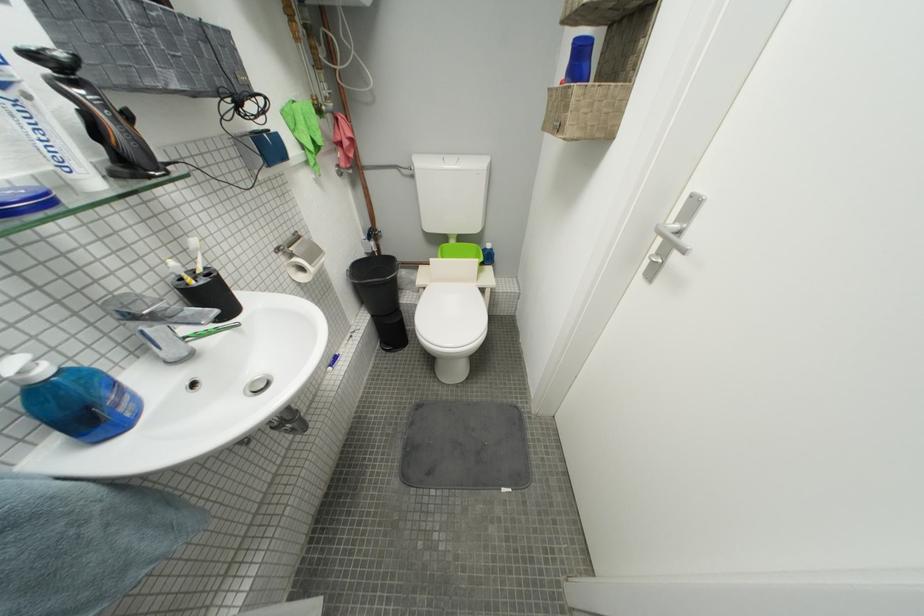
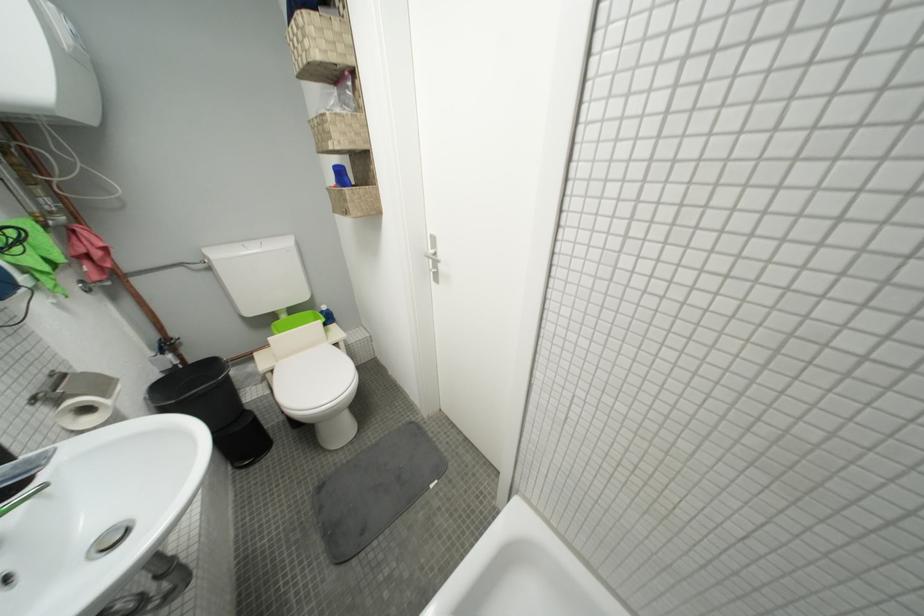
Locate, in the second image, the point that corresponds to the point at 460,244 in the first image.

(293, 318)